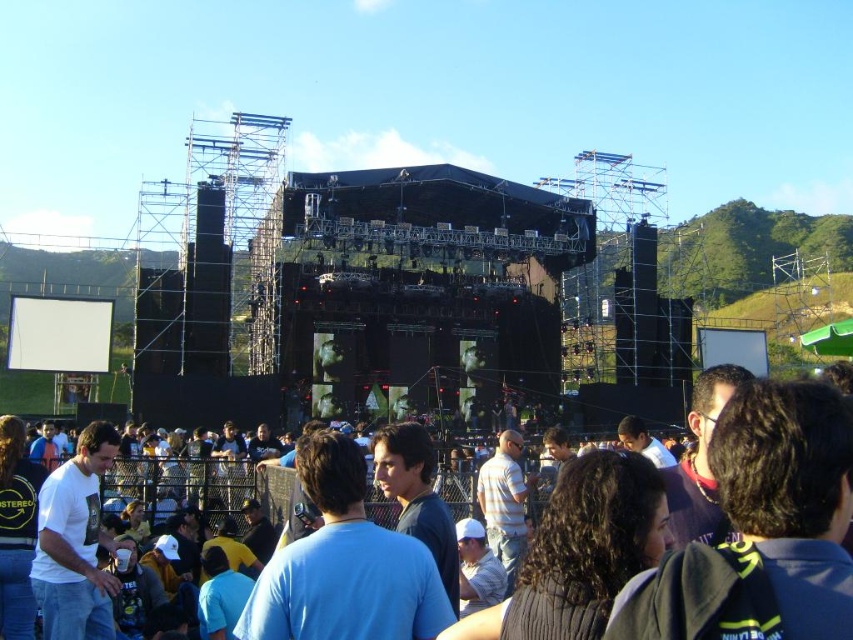
Is blue cotton shirt at center to the left of white cotton shirt at lower left from the viewer's perspective?

Incorrect, blue cotton shirt at center is not on the left side of white cotton shirt at lower left.

Can you confirm if blue cotton shirt at center is positioned to the right of white cotton shirt at lower left?

Yes, blue cotton shirt at center is to the right of white cotton shirt at lower left.

Between point (463, 476) and point (45, 589), which one is positioned in front?

Positioned in front is point (45, 589).

Where is `blue cotton shirt at center`? blue cotton shirt at center is located at coordinates (196, 483).